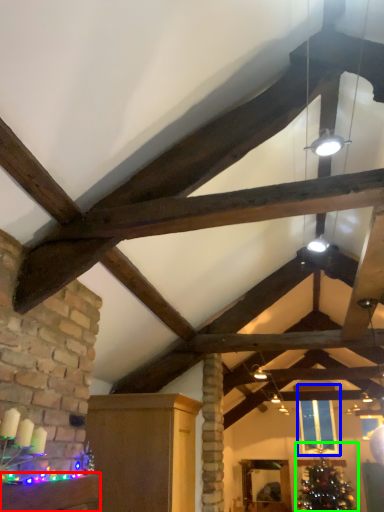
Question: Which is farther away from furniture (highlighted by a red box)? window (highlighted by a blue box) or christmas tree (highlighted by a green box)?

Choices:
 (A) window
 (B) christmas tree

Answer: (B)